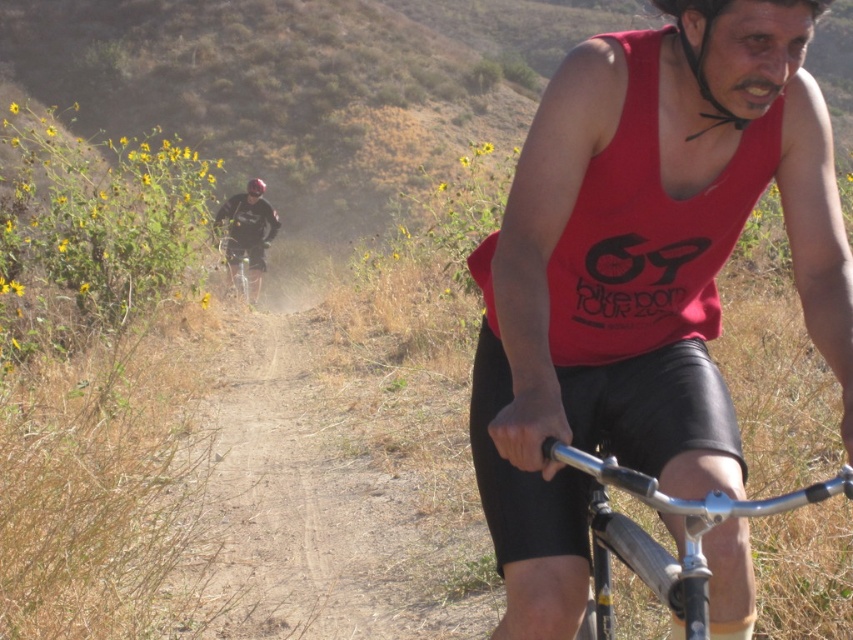
Question: Can you confirm if dark gray fabric jacket at upper center is wider than shiny black helmet at upper center?

Choices:
 (A) no
 (B) yes

Answer: (A)

Question: Does red matte tank top at center have a lesser width compared to black matte bicycle helmet at upper center?

Choices:
 (A) yes
 (B) no

Answer: (B)

Question: Which point appears closest to the camera in this image?

Choices:
 (A) (265, 248)
 (B) (251, 184)
 (C) (576, 152)

Answer: (C)

Question: Which is farther from the black matte bicycle helmet at upper center?

Choices:
 (A) red matte tank top at center
 (B) shiny black helmet at upper center

Answer: (B)

Question: Does red matte tank top at center appear on the left side of silver metallic handlebars at center?

Choices:
 (A) yes
 (B) no

Answer: (B)

Question: Which of the following is the farthest from the observer?

Choices:
 (A) (682, 488)
 (B) (238, 262)

Answer: (B)